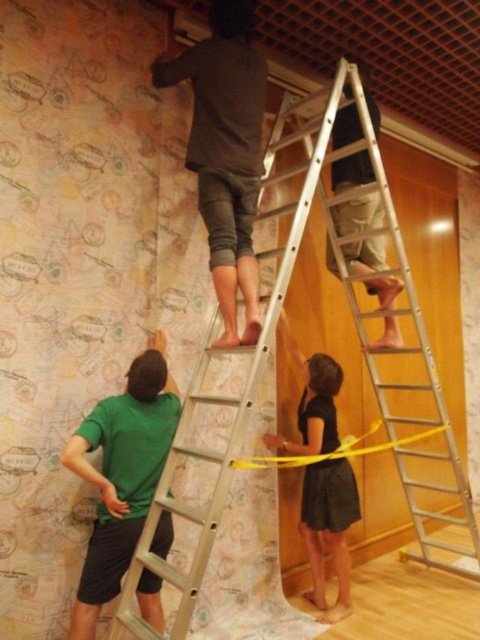
You are standing in the room and want to reach the top of the silver metallic ladder at upper center. There is a green cotton shirt at lower left nearby. Which object is closer to you, the ladder or the shirt?

The silver metallic ladder at upper center is further to the viewer than the green cotton shirt at lower left, so the shirt is closer to you.

You are helping to wallpaper a wall and need to reach the top of the silver metallic ladder at upper center. The green cotton shirt at lower left is blocking your path. Can you move around the ladder to access the top?

The silver metallic ladder at upper center is located above the green cotton shirt at lower left, so you can move around the ladder to access the top since the shirt is below it and not directly in the path.

You are holding a camera and want to take a photo of the silver metallic ladder at center. If you are currently standing 6.59 feet away from the ladder, is this distance within the recommended 8 feet range for capturing clear details?

Answer: The silver metallic ladder at center and camera are 6.59 feet apart from each other. Since 6.59 feet is less than 8 feet, the distance is within the recommended range for capturing clear details.